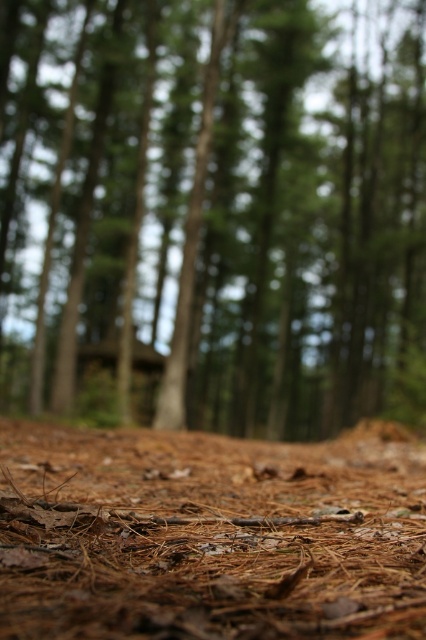
Does brown textured ground at lower center have a larger size compared to brown pine needles at lower center?

Yes.

Is brown textured ground at lower center to the left of brown pine needles at lower center from the viewer's perspective?

Incorrect, brown textured ground at lower center is not on the left side of brown pine needles at lower center.

Is point (336, 228) farther from camera compared to point (311, 616)?

That is True.

Locate an element on the screen. This screenshot has width=426, height=640. brown textured ground at lower center is located at coordinates (216, 211).